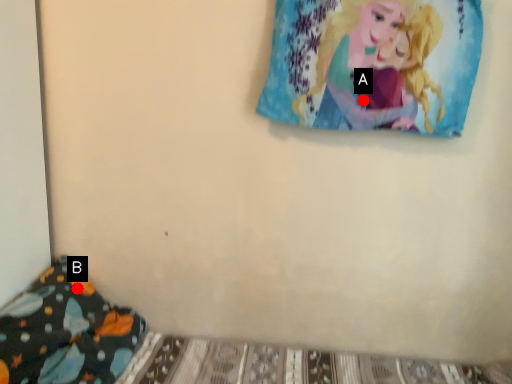
Question: Two points are circled on the image, labeled by A and B beside each circle. Which point is farther from the camera taking this photo?

Choices:
 (A) A is further
 (B) B is further

Answer: (B)